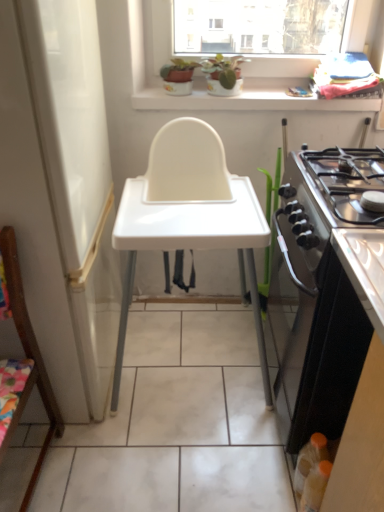
Question: Can you confirm if wooden chair at left is positioned to the left of white plastic changing table at center?

Choices:
 (A) yes
 (B) no

Answer: (A)

Question: From a real-world perspective, is wooden chair at left below white plastic changing table at center?

Choices:
 (A) no
 (B) yes

Answer: (B)

Question: Is wooden chair at left positioned with its back to white plastic changing table at center?

Choices:
 (A) no
 (B) yes

Answer: (A)

Question: Considering the relative sizes of wooden chair at left and white plastic changing table at center in the image provided, is wooden chair at left taller than white plastic changing table at center?

Choices:
 (A) no
 (B) yes

Answer: (A)

Question: Can you confirm if wooden chair at left is thinner than white plastic changing table at center?

Choices:
 (A) yes
 (B) no

Answer: (A)

Question: Considering the relative positions of wooden chair at left and white plastic changing table at center in the image provided, is wooden chair at left to the right of white plastic changing table at center from the viewer's perspective?

Choices:
 (A) no
 (B) yes

Answer: (A)

Question: Does translucent plastic bottle at lower right appear on the right side of wooden chair at left?

Choices:
 (A) no
 (B) yes

Answer: (B)

Question: Is translucent plastic bottle at lower right behind wooden chair at left?

Choices:
 (A) no
 (B) yes

Answer: (B)

Question: Is the position of translucent plastic bottle at lower right less distant than that of wooden chair at left?

Choices:
 (A) yes
 (B) no

Answer: (B)

Question: Is wooden chair at left at the back of translucent plastic bottle at lower right?

Choices:
 (A) no
 (B) yes

Answer: (A)

Question: Can you confirm if translucent plastic bottle at lower right is shorter than wooden chair at left?

Choices:
 (A) no
 (B) yes

Answer: (B)

Question: From the image's perspective, is translucent plastic bottle at lower right under wooden chair at left?

Choices:
 (A) yes
 (B) no

Answer: (A)

Question: Can you confirm if wooden chair at left is thinner than black glossy oven at right?

Choices:
 (A) no
 (B) yes

Answer: (B)